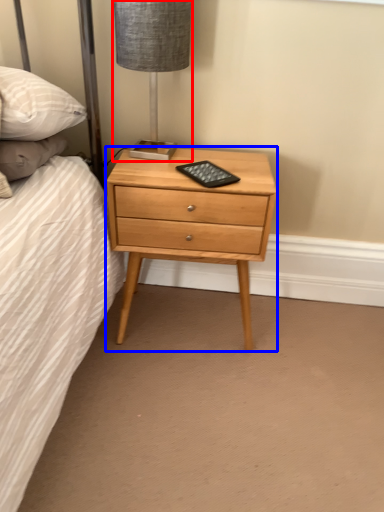
Question: Which object appears farthest to the camera in this image, table lamp (highlighted by a red box) or nightstand (highlighted by a blue box)?

Choices:
 (A) table lamp
 (B) nightstand

Answer: (B)